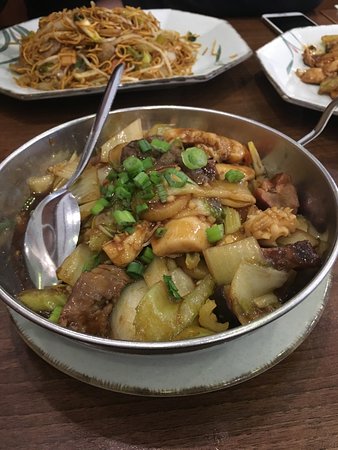
The width and height of the screenshot is (338, 450). What are the coordinates of `chinese dish` in the screenshot? It's located at (176, 234).